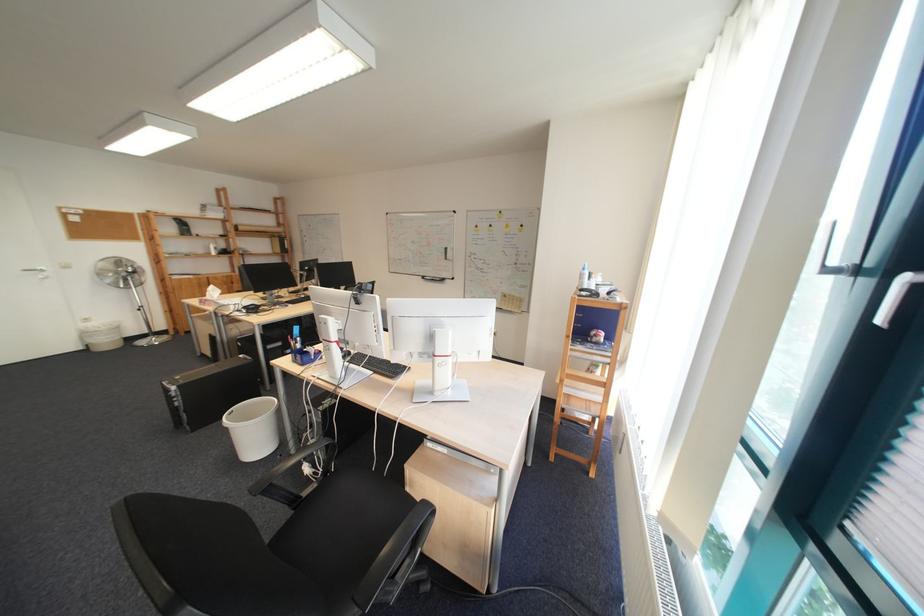
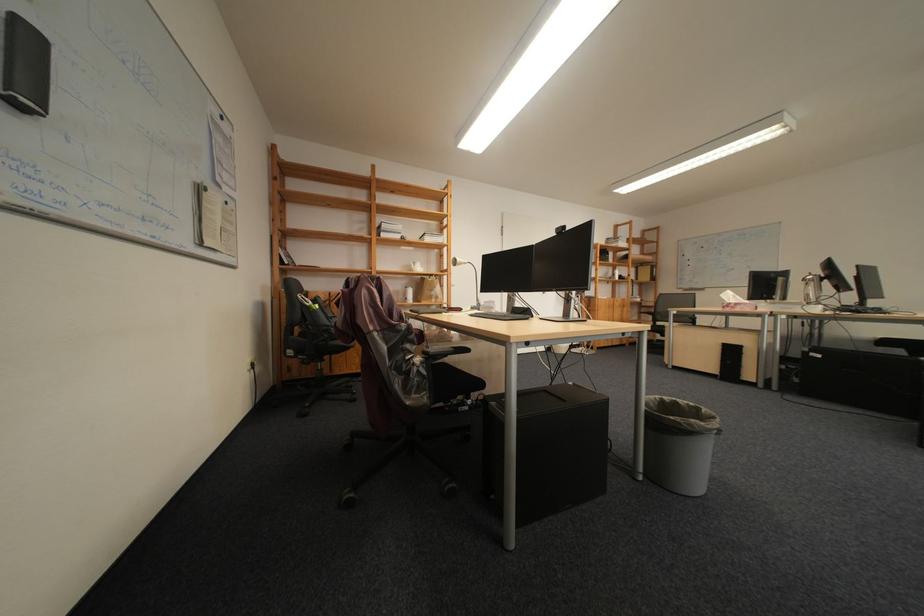
Where in the second image is the point corresponding to [219,305] from the first image?

(747, 309)